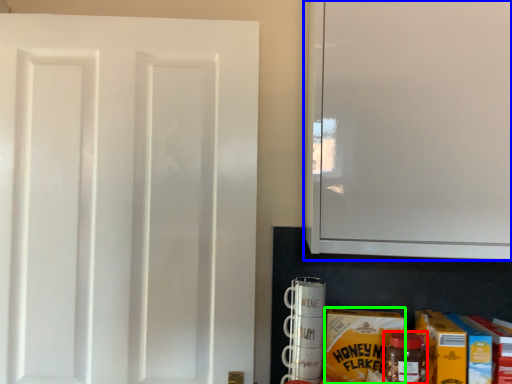
Question: Which object is the closest to the bottle (highlighted by a red box)? Choose among these: cabinetry (highlighted by a blue box) or carton (highlighted by a green box).

Choices:
 (A) cabinetry
 (B) carton

Answer: (B)